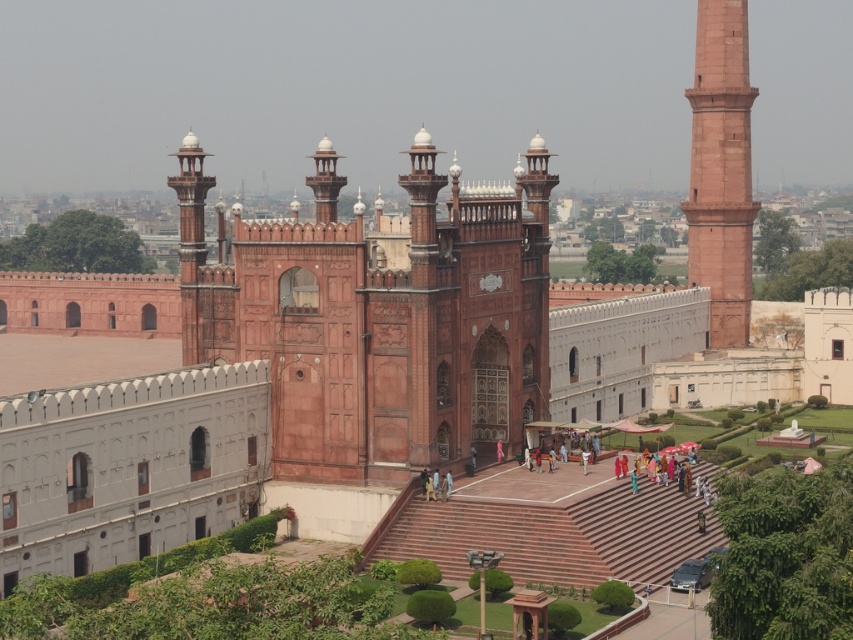
Does point (366, 448) come farther from viewer compared to point (698, 278)?

No, it is not.

Between point (363, 353) and point (711, 316), which one is positioned in front?

Point (363, 353) is more forward.

Is point (189, 145) in front of point (741, 248)?

Yes.

Locate an element on the screen. The height and width of the screenshot is (640, 853). reddish-brown stone archway at center is located at coordinates (379, 316).